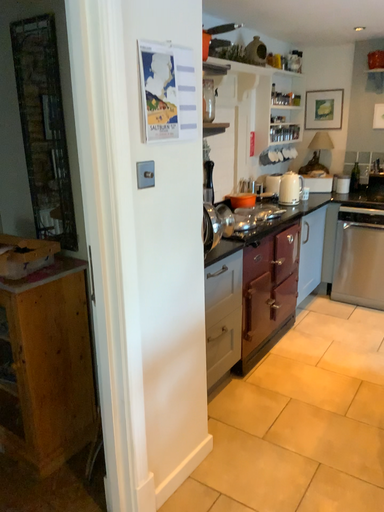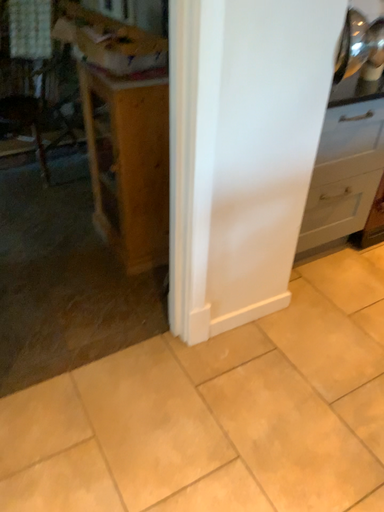
Question: Which way did the camera rotate in the video?

Choices:
 (A) rotated downward
 (B) rotated upward

Answer: (A)